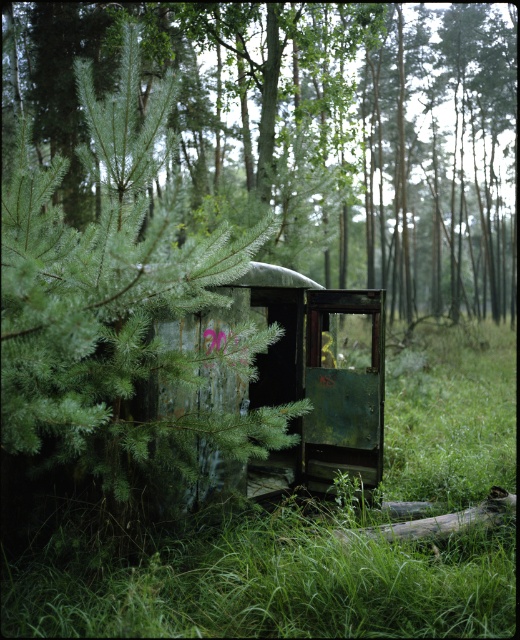
Does green grassy at center appear on the right side of green weathered train car at center?

Yes, green grassy at center is to the right of green weathered train car at center.

You are a GUI agent. You are given a task and a screenshot of the screen. Output one action in this format:
    pyautogui.click(x=<x>, y=<y>)
    Task: Click on the green grassy at center
    
    Given the screenshot: What is the action you would take?
    pyautogui.click(x=248, y=576)

Is green matte tree at center to the right of green weathered train car at center from the viewer's perspective?

No, green matte tree at center is not to the right of green weathered train car at center.

Is point (270, 35) positioned before point (346, 403)?

No.

Is point (449, 141) in front of point (295, 272)?

That is False.

The width and height of the screenshot is (520, 640). What are the coordinates of `green matte tree at center` in the screenshot? It's located at (309, 131).

Consider the image. Which is more to the left, green matte tree at center or green grassy at center?

Positioned to the left is green matte tree at center.

Does green matte tree at center come in front of green grassy at center?

No, it is not.

Is point (295, 172) in front of point (459, 636)?

No, (295, 172) is behind (459, 636).

Find the location of a particular element. The image size is (520, 640). green matte tree at center is located at coordinates (309, 131).